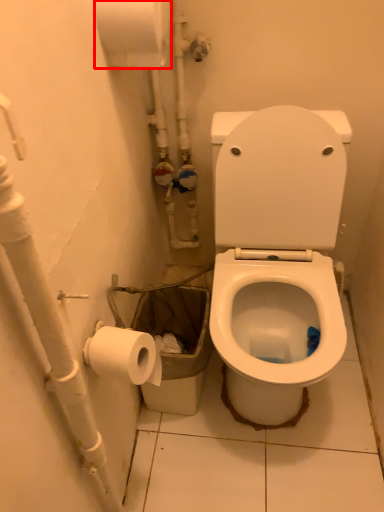
Question: From the image's perspective, what is the correct spatial positioning of toilet paper (annotated by the red box) in reference to water pipe?

Choices:
 (A) above
 (B) below

Answer: (A)